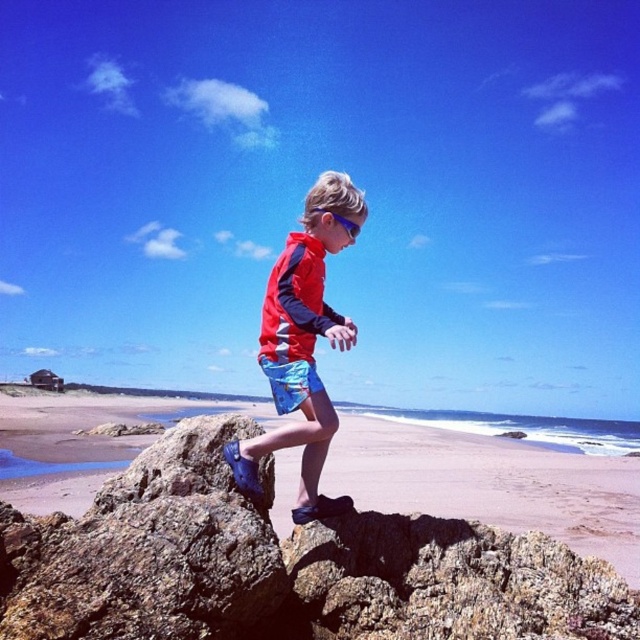
Question: Which object appears closest to the camera in this image?

Choices:
 (A) smooth sand beach at center
 (B) matte red rash guard at center
 (C) blue printed shorts at center
 (D) matte red jacket at center

Answer: (B)

Question: Is matte red rash guard at center wider than blue printed shorts at center?

Choices:
 (A) yes
 (B) no

Answer: (A)

Question: Estimate the real-world distances between objects in this image. Which object is farther from the blue printed shorts at center?

Choices:
 (A) smooth sand beach at center
 (B) matte red rash guard at center
 (C) matte red jacket at center

Answer: (A)

Question: Which of the following is the farthest from the observer?

Choices:
 (A) matte red rash guard at center
 (B) smooth sand beach at center
 (C) blue printed shorts at center

Answer: (B)

Question: Is smooth sand beach at center in front of matte red rash guard at center?

Choices:
 (A) no
 (B) yes

Answer: (A)

Question: Can you confirm if smooth sand beach at center is positioned to the right of matte red jacket at center?

Choices:
 (A) no
 (B) yes

Answer: (A)